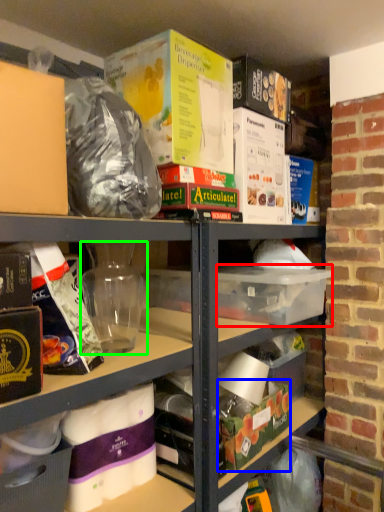
Question: Considering the real-world distances, which object is closest to storage box (highlighted by a red box)? storage box (highlighted by a blue box) or yoghurt (highlighted by a green box).

Choices:
 (A) storage box
 (B) yoghurt

Answer: (A)